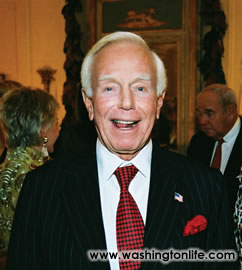
Where is `wall`? wall is located at coordinates (47, 40), (233, 30).